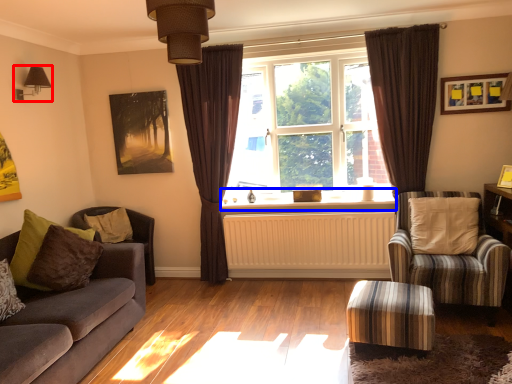
Question: Among these objects, which one is nearest to the camera, light fixture (highlighted by a red box) or window sill (highlighted by a blue box)?

Choices:
 (A) light fixture
 (B) window sill

Answer: (A)